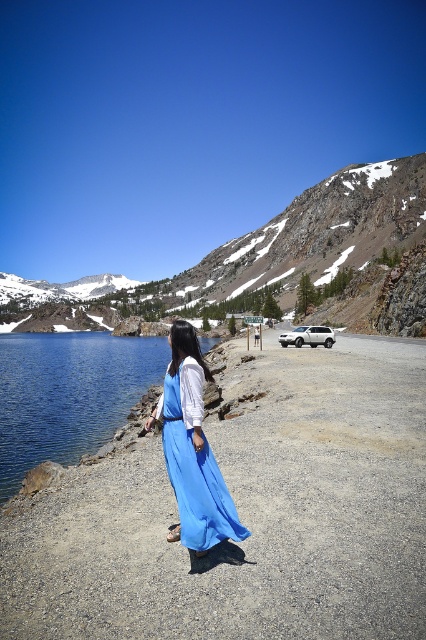
Question: Which object is the closest to the blue satin dress at center?

Choices:
 (A) blue fabric dress at center
 (B) blue glassy water at lower left

Answer: (A)

Question: Which object is positioned farthest from the blue glassy water at lower left?

Choices:
 (A) blue fabric dress at center
 (B) blue satin dress at center

Answer: (B)

Question: Is blue fabric dress at center wider than blue glassy water at lower left?

Choices:
 (A) yes
 (B) no

Answer: (B)

Question: Where is blue glassy water at lower left located in relation to blue satin dress at center in the image?

Choices:
 (A) right
 (B) left

Answer: (B)

Question: In this image, where is blue glassy water at lower left located relative to blue satin dress at center?

Choices:
 (A) above
 (B) below

Answer: (A)

Question: Which object is positioned farthest from the blue fabric dress at center?

Choices:
 (A) blue satin dress at center
 (B) blue glassy water at lower left

Answer: (B)